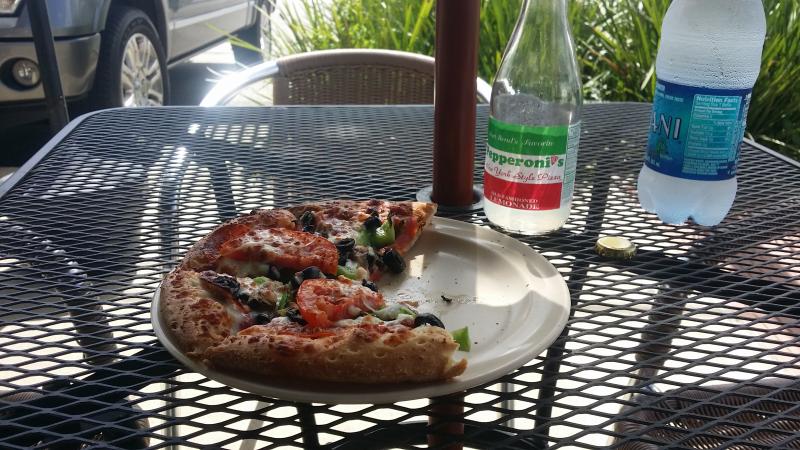
You are a GUI agent. You are given a task and a screenshot of the screen. Output one action in this format:
    pyautogui.click(x=<x>, y=<y>)
    Task: Click on the bottle
    The height and width of the screenshot is (450, 800).
    Given the screenshot: What is the action you would take?
    pyautogui.click(x=569, y=78)